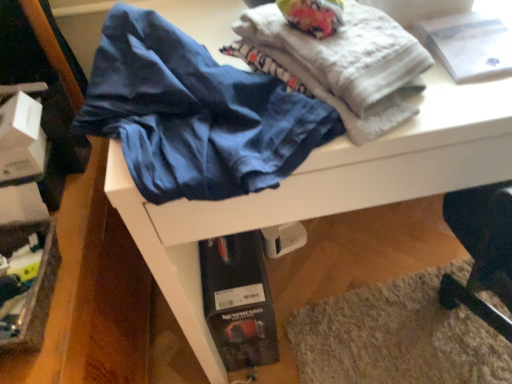
In order to click on blank space situated above white textured towel at upper center (from a real-world perspective) in this screenshot , I will do `click(344, 41)`.